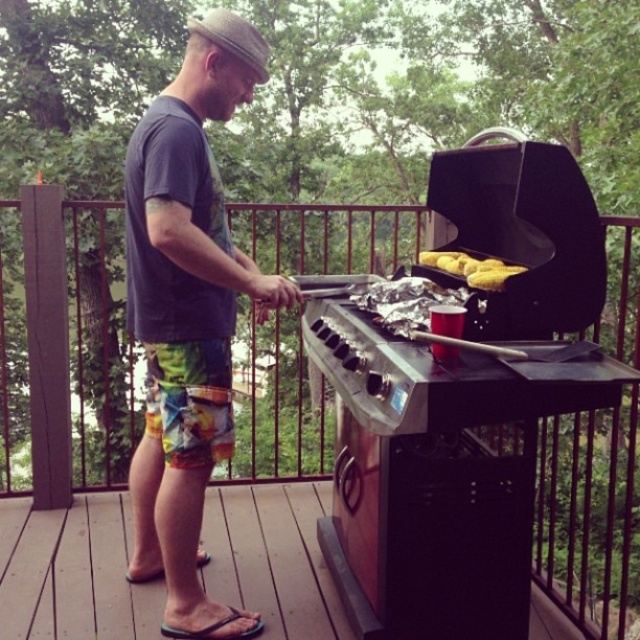
Does dark gray t-shirt at center appear on the left side of yellow matte corn at center?

Yes, dark gray t-shirt at center is to the left of yellow matte corn at center.

Is dark gray t-shirt at center positioned before yellow matte corn at center?

No, dark gray t-shirt at center is behind yellow matte corn at center.

Between point (204, 204) and point (432, 259), which one is positioned behind?

Positioned behind is point (432, 259).

Identify the location of dark gray t-shirt at center. (188, 316).

Does multicolored printed shorts at lower center have a larger size compared to yellow matte corn at center?

Yes.

Identify the location of multicolored printed shorts at lower center. This screenshot has width=640, height=640. (189, 401).

Identify the location of multicolored printed shorts at lower center. (189, 401).

Based on the photo, can you confirm if dark gray t-shirt at center is shorter than wooden deck at lower left?

In fact, dark gray t-shirt at center may be taller than wooden deck at lower left.

Between point (193, 442) and point (310, 488), which one is positioned in front?

Point (193, 442) is in front.

Where is `dark gray t-shirt at center`? dark gray t-shirt at center is located at coordinates (188, 316).